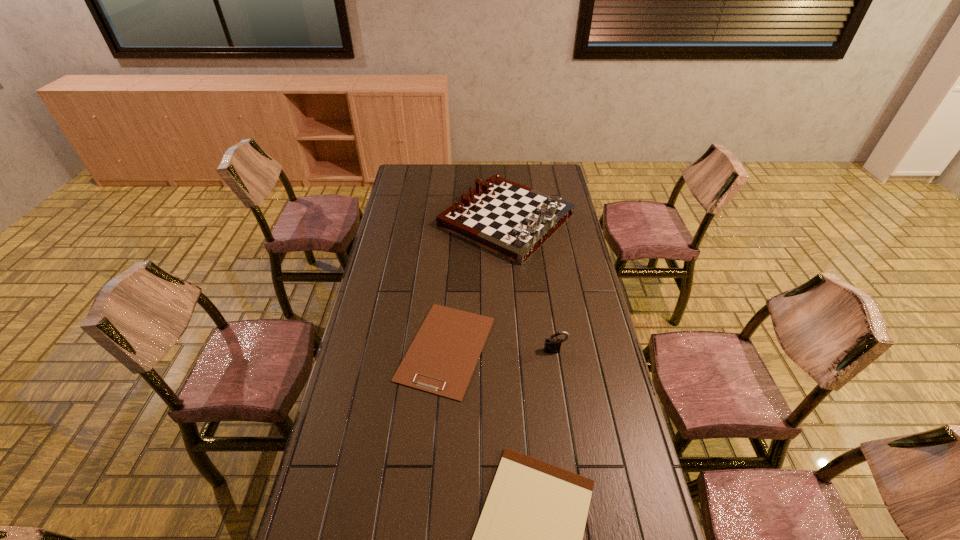
Locate an element on the screen. Image resolution: width=960 pixels, height=540 pixels. gameboard at the right edge is located at coordinates (509, 219).

At what (x,y) coordinates should I click in order to perform the action: click on padlock that is at the right edge. Please return your answer as a coordinate pair (x, y). Looking at the image, I should click on (552, 345).

This screenshot has height=540, width=960. Identify the location of object that is at the far right corner. (509, 219).

Locate an element on the screen. free space at the left edge of the desktop is located at coordinates (376, 431).

What are the coordinates of `vacant area at the right edge of the desktop` in the screenshot? It's located at (570, 271).

Where is `free point at the far right corner`? free point at the far right corner is located at coordinates (543, 165).

Locate an element on the screen. empty space that is in between the second tallest object and the second shortest object is located at coordinates (501, 349).

The height and width of the screenshot is (540, 960). Find the location of `blank region between the second tallest object and the third tallest object`. blank region between the second tallest object and the third tallest object is located at coordinates (501, 349).

Where is `vacant area between the third shortest object and the farthest object`? vacant area between the third shortest object and the farthest object is located at coordinates (531, 285).

The height and width of the screenshot is (540, 960). In order to click on free spot between the padlock and the gameboard in this screenshot , I will do `click(531, 285)`.